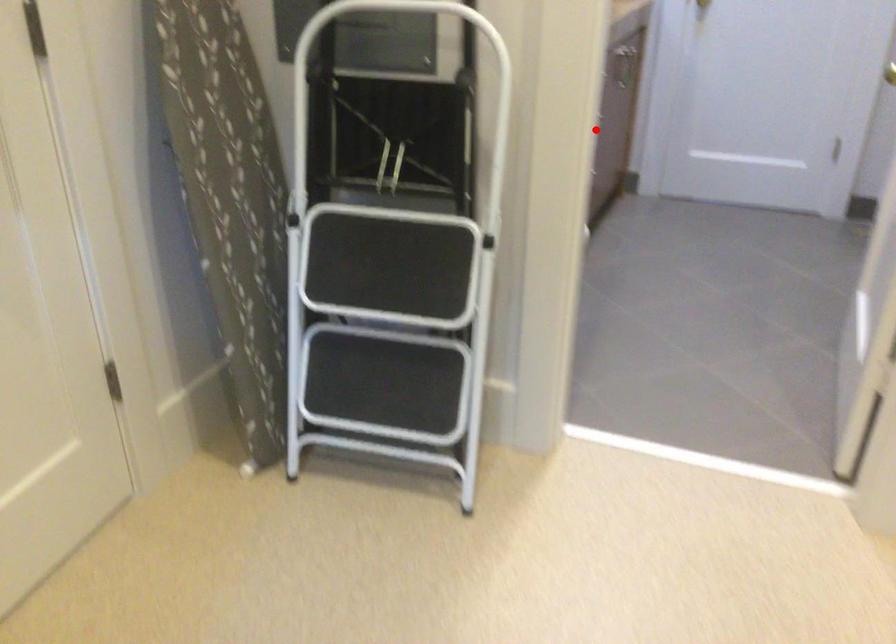
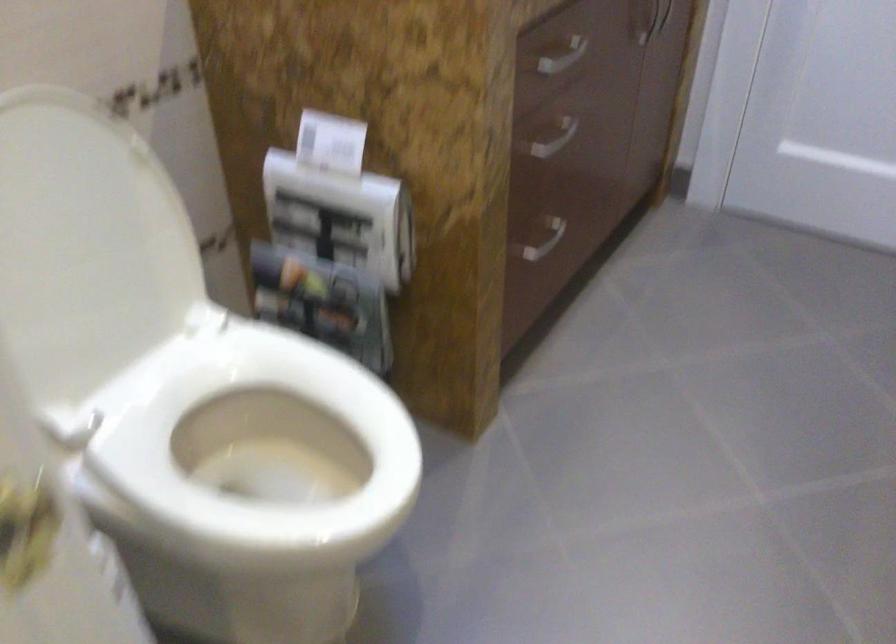
Question: I am providing you with two images of the same scene from different viewpoints. Image1 has a red point marked. In image2, the corresponding 3D location appears at what relative position? Reply with the corresponding letter.

Choices:
 (A) Closer
 (B) Farther

Answer: (A)